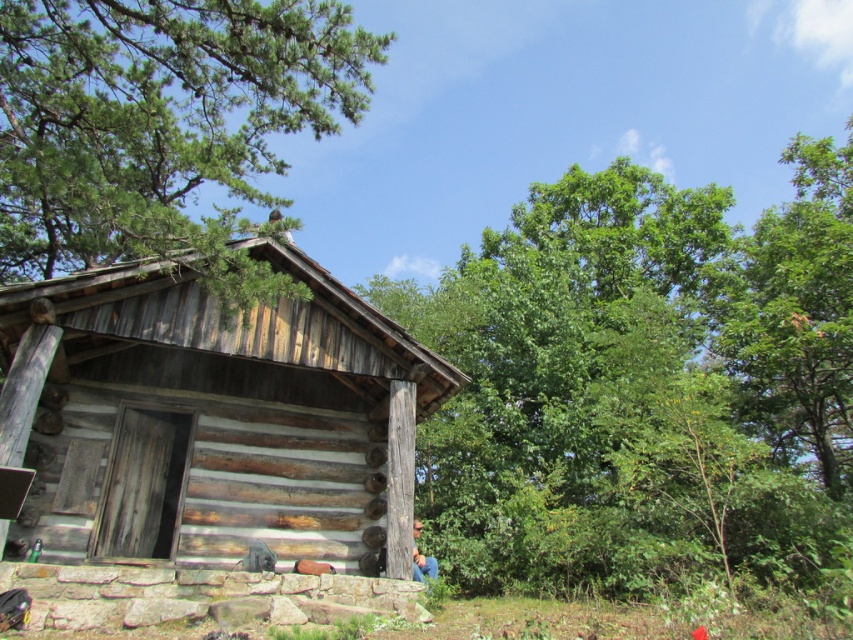
Is green leafy tree at right above weathered wood cabin at center?

Indeed, green leafy tree at right is positioned over weathered wood cabin at center.

Which is in front, point (517, 216) or point (393, 336)?

Point (393, 336) is in front.

In order to click on green leafy tree at right in this screenshot , I will do `click(642, 385)`.

Which of these two, weathered wood cabin at center or green pine tree at upper left, stands shorter?

With less height is weathered wood cabin at center.

Between weathered wood cabin at center and green pine tree at upper left, which one appears on the right side from the viewer's perspective?

Positioned to the right is weathered wood cabin at center.

Is point (62, 540) positioned behind point (270, 29)?

No, it is not.

Find the location of a particular element. weathered wood cabin at center is located at coordinates (207, 436).

How far apart are green leafy tree at right and green pine tree at upper left?

A distance of 31.50 feet exists between green leafy tree at right and green pine tree at upper left.

The width and height of the screenshot is (853, 640). In order to click on green leafy tree at right in this screenshot , I will do `click(642, 385)`.

Where is `green leafy tree at right`? This screenshot has height=640, width=853. green leafy tree at right is located at coordinates (642, 385).